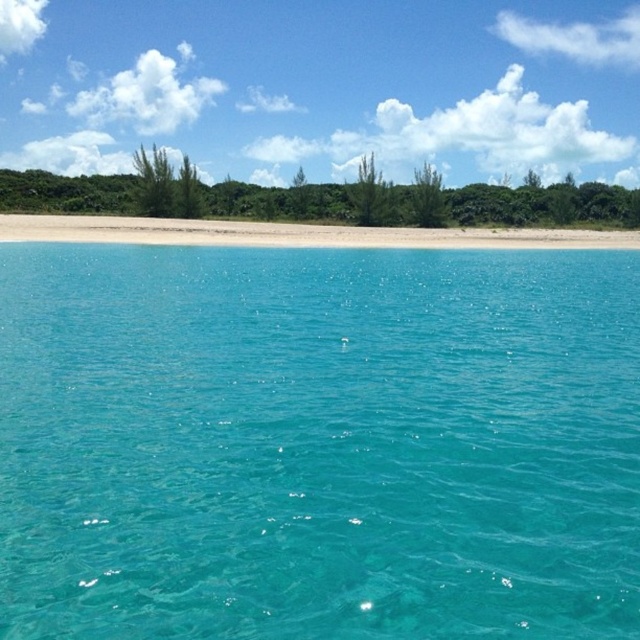
Question: Which point is closer to the camera?

Choices:
 (A) white sand beach at center
 (B) turquoise glossy water at center

Answer: (B)

Question: Does turquoise glossy water at center have a lesser width compared to white sand beach at center?

Choices:
 (A) no
 (B) yes

Answer: (B)

Question: Does turquoise glossy water at center have a greater width compared to white sand beach at center?

Choices:
 (A) yes
 (B) no

Answer: (B)

Question: Which point is closer to the camera taking this photo?

Choices:
 (A) (36, 225)
 (B) (588, 337)

Answer: (B)

Question: Is turquoise glossy water at center above white sand beach at center?

Choices:
 (A) no
 (B) yes

Answer: (A)